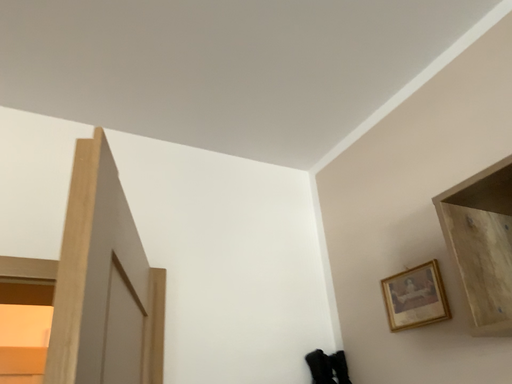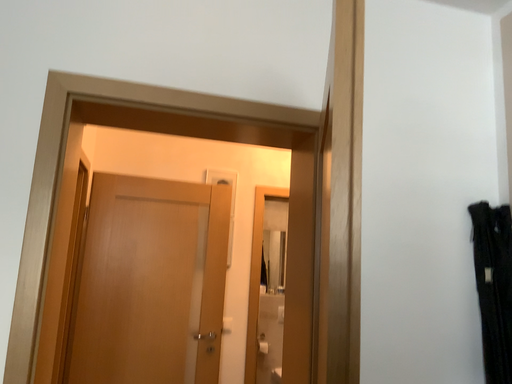
Question: How did the camera likely rotate when shooting the video?

Choices:
 (A) rotated downward
 (B) rotated upward

Answer: (A)